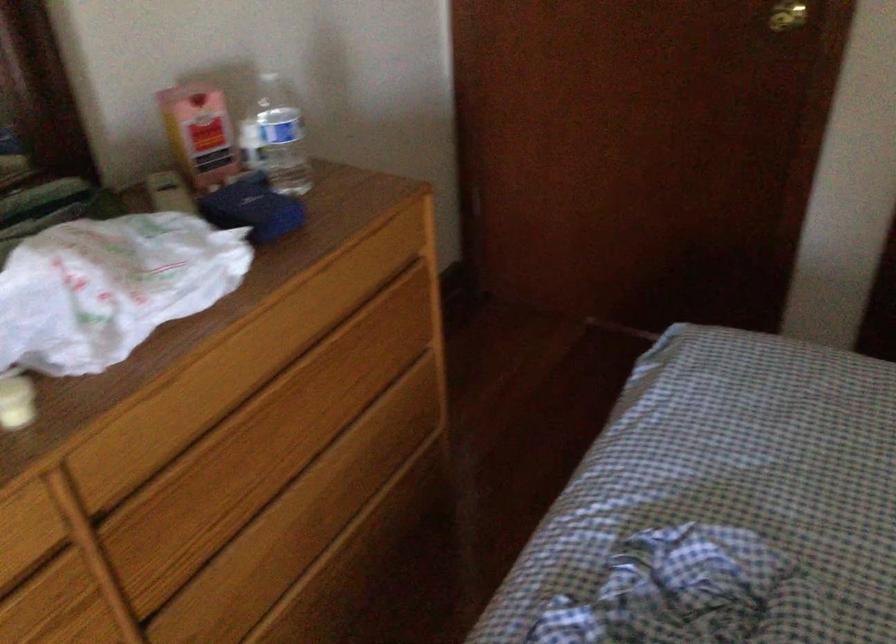
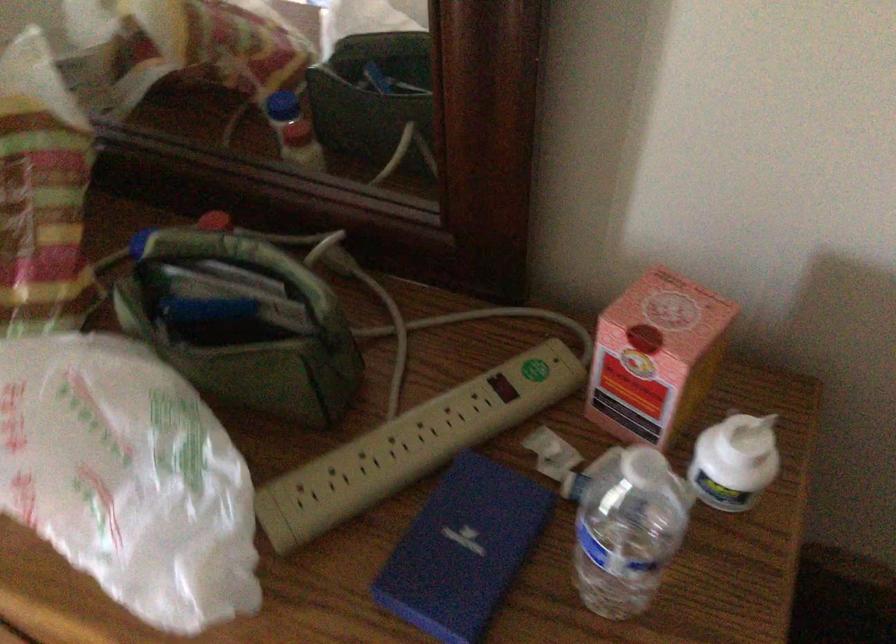
In the second image, find the point that corresponds to point 138,267 in the first image.

(126, 478)